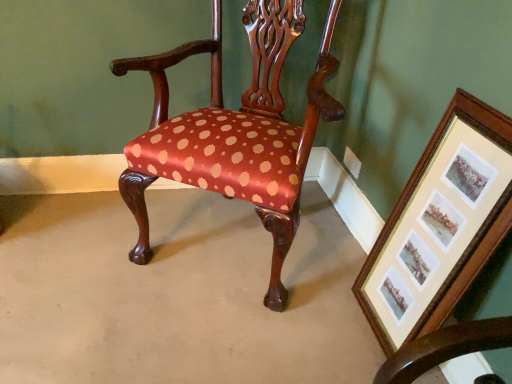
Question: Is satin fabric chair at center further to the viewer compared to wooden framed prints at lower right?

Choices:
 (A) no
 (B) yes

Answer: (B)

Question: Can you confirm if satin fabric chair at center is smaller than wooden framed prints at lower right?

Choices:
 (A) yes
 (B) no

Answer: (B)

Question: Does satin fabric chair at center have a lesser height compared to wooden framed prints at lower right?

Choices:
 (A) no
 (B) yes

Answer: (A)

Question: Does satin fabric chair at center contain wooden framed prints at lower right?

Choices:
 (A) yes
 (B) no

Answer: (B)

Question: Does satin fabric chair at center have a greater height compared to wooden framed prints at lower right?

Choices:
 (A) yes
 (B) no

Answer: (A)

Question: Is satin fabric chair at center positioned with its back to wooden framed prints at lower right?

Choices:
 (A) no
 (B) yes

Answer: (A)

Question: Is wooden framed prints at lower right not near satin fabric chair at center?

Choices:
 (A) yes
 (B) no

Answer: (B)

Question: Is wooden framed prints at lower right at the left side of satin fabric chair at center?

Choices:
 (A) yes
 (B) no

Answer: (B)

Question: From the image's perspective, does wooden framed prints at lower right appear lower than satin fabric chair at center?

Choices:
 (A) no
 (B) yes

Answer: (B)

Question: Could you tell me if wooden framed prints at lower right is turned towards satin fabric chair at center?

Choices:
 (A) yes
 (B) no

Answer: (B)

Question: Is the depth of wooden framed prints at lower right greater than that of satin fabric chair at center?

Choices:
 (A) no
 (B) yes

Answer: (A)

Question: Can you confirm if wooden framed prints at lower right is positioned to the right of satin fabric chair at center?

Choices:
 (A) no
 (B) yes

Answer: (B)

Question: Is satin fabric chair at center taller or shorter than wooden framed prints at lower right?

Choices:
 (A) tall
 (B) short

Answer: (A)